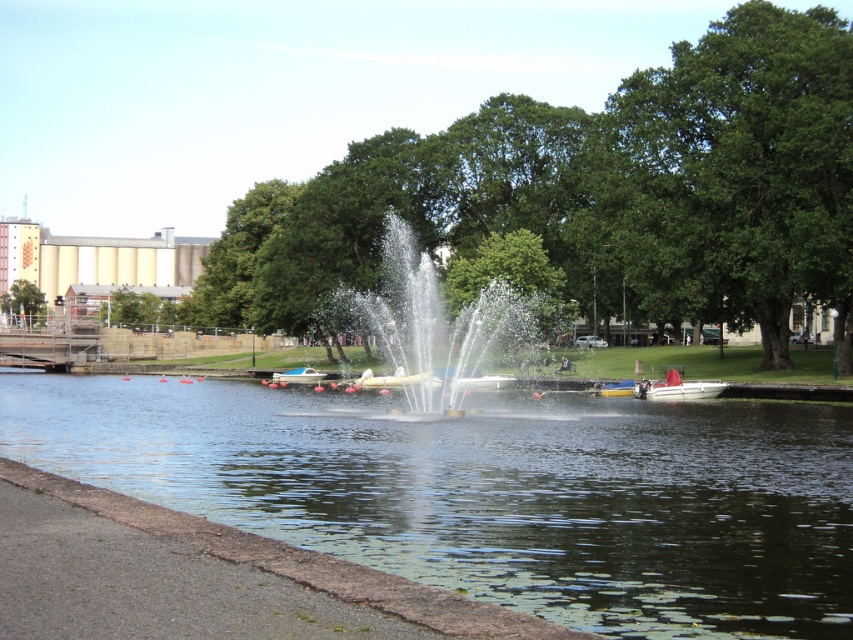
Question: Which object is closer to the camera taking this photo?

Choices:
 (A) white plastic boat at center
 (B) clear water at center

Answer: (B)

Question: Which point is closer to the camera?

Choices:
 (A) green leafy tree at center
 (B) white glossy boat at right

Answer: (B)

Question: Is green leafy tree at center smaller than green leafy tree at left?

Choices:
 (A) yes
 (B) no

Answer: (A)

Question: Where is green leafy tree at upper right located in relation to white glossy boat at center in the image?

Choices:
 (A) below
 (B) above

Answer: (B)

Question: Which object is the closest to the green leafy tree at upper right?

Choices:
 (A) white glossy boat at center
 (B) green leafy tree at left
 (C) green leafy tree at center
 (D) white plastic boat at center

Answer: (C)

Question: Is green leafy tree at upper right thinner than clear water fountain at center?

Choices:
 (A) no
 (B) yes

Answer: (A)